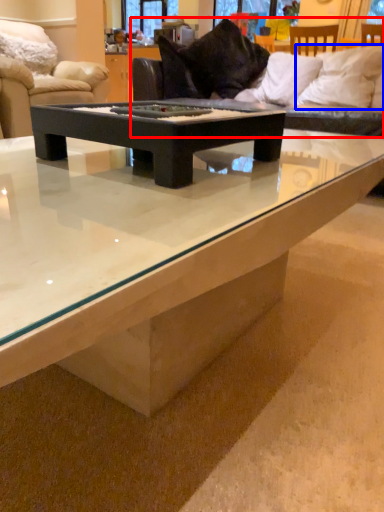
Question: Which object is further to the camera taking this photo, studio couch (highlighted by a red box) or pillow (highlighted by a blue box)?

Choices:
 (A) studio couch
 (B) pillow

Answer: (B)